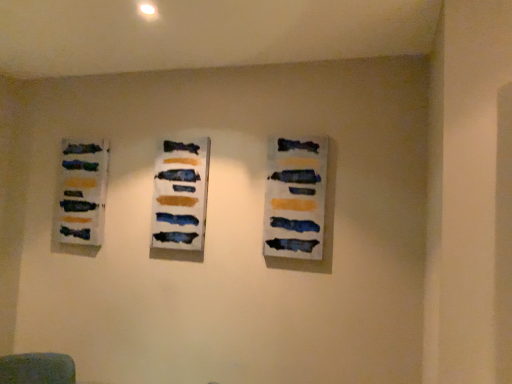
Question: Could you tell me if matte acrylic painting at center, which ranks as the 2th art exhibition in left-to-right order, is turned towards matte acrylic painting at center, marked as the first art exhibition in a front-to-back arrangement?

Choices:
 (A) no
 (B) yes

Answer: (A)

Question: Is matte acrylic painting at center, which ranks as the 2th art exhibition in left-to-right order, shorter than matte acrylic painting at center, which ranks as the first art exhibition in right-to-left order?

Choices:
 (A) yes
 (B) no

Answer: (B)

Question: Can you confirm if matte acrylic painting at center, acting as the 2th art exhibition starting from the back, is bigger than matte acrylic painting at center, marked as the first art exhibition in a front-to-back arrangement?

Choices:
 (A) yes
 (B) no

Answer: (A)

Question: Is matte acrylic painting at center, acting as the 2th art exhibition starting from the back, smaller than matte acrylic painting at center, the third art exhibition from the left?

Choices:
 (A) no
 (B) yes

Answer: (A)

Question: From the image's perspective, does matte acrylic painting at center, acting as the 2th art exhibition starting from the back, appear higher than matte acrylic painting at center, the third art exhibition from the left?

Choices:
 (A) yes
 (B) no

Answer: (A)

Question: Is matte acrylic painting at center, acting as the 2th art exhibition starting from the back, located outside matte acrylic painting at center, the third art exhibition from the back?

Choices:
 (A) yes
 (B) no

Answer: (A)

Question: Can you confirm if textured acrylic painting at left, acting as the 3th art exhibition starting from the front, is taller than matte acrylic painting at center, which ranks as the first art exhibition in right-to-left order?

Choices:
 (A) yes
 (B) no

Answer: (B)

Question: Is textured acrylic painting at left, acting as the 3th art exhibition starting from the front, closer to camera compared to matte acrylic painting at center, which ranks as the first art exhibition in right-to-left order?

Choices:
 (A) yes
 (B) no

Answer: (B)

Question: Considering the relative sizes of textured acrylic painting at left, acting as the first art exhibition starting from the back, and matte acrylic painting at center, the third art exhibition from the left, in the image provided, is textured acrylic painting at left, acting as the first art exhibition starting from the back, bigger than matte acrylic painting at center, the third art exhibition from the left,?

Choices:
 (A) no
 (B) yes

Answer: (B)

Question: Does textured acrylic painting at left, acting as the third art exhibition starting from the right, appear on the right side of matte acrylic painting at center, marked as the first art exhibition in a front-to-back arrangement?

Choices:
 (A) no
 (B) yes

Answer: (A)

Question: Can you confirm if textured acrylic painting at left, acting as the third art exhibition starting from the right, is thinner than matte acrylic painting at center, marked as the first art exhibition in a front-to-back arrangement?

Choices:
 (A) no
 (B) yes

Answer: (A)

Question: Is textured acrylic painting at left, acting as the third art exhibition starting from the right, far from matte acrylic painting at center, the third art exhibition from the left?

Choices:
 (A) yes
 (B) no

Answer: (A)

Question: Is matte acrylic painting at center, which ranks as the 2th art exhibition in left-to-right order, completely or partially inside textured acrylic painting at left, acting as the third art exhibition starting from the right?

Choices:
 (A) yes
 (B) no

Answer: (B)